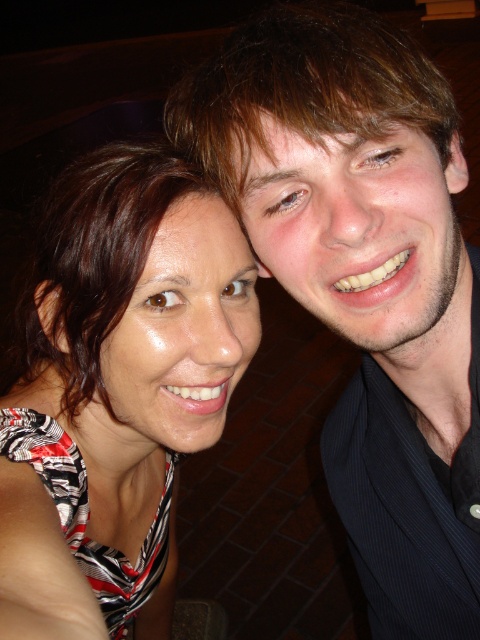
You are standing at the point marked by coordinates point (424, 445) and want to take a photo of the two people in the scene. If your camera has a focal length of 35mm and you want to capture both individuals in frame without moving, what is the minimum distance you should maintain from the point to ensure both are fully visible?

The point marked by coordinates point (424, 445) is 29.01 inches away from the viewer. To capture both individuals in frame without moving, the minimum distance should be maintained at least 29.01 inches from the point.

Consider the image. You are taking a photo of two people standing in front of you. You notice two specific points on their bodies marked as point (x=435, y=198) and point (x=59, y=532). If you want to focus on the point that is closer to your camera, which point should you choose?

You should focus on point (x=435, y=198) because it is closer to the camera than point (x=59, y=532).